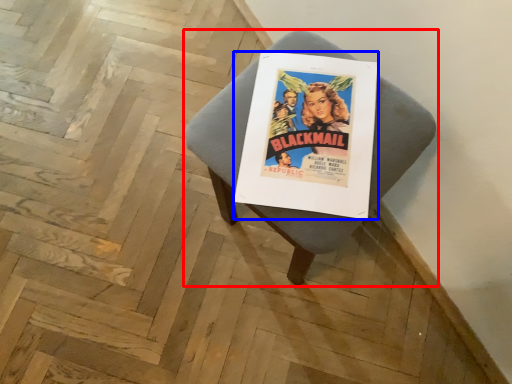
Question: Which object appears farthest to the camera in this image, furniture (highlighted by a red box) or poster (highlighted by a blue box)?

Choices:
 (A) furniture
 (B) poster

Answer: (B)